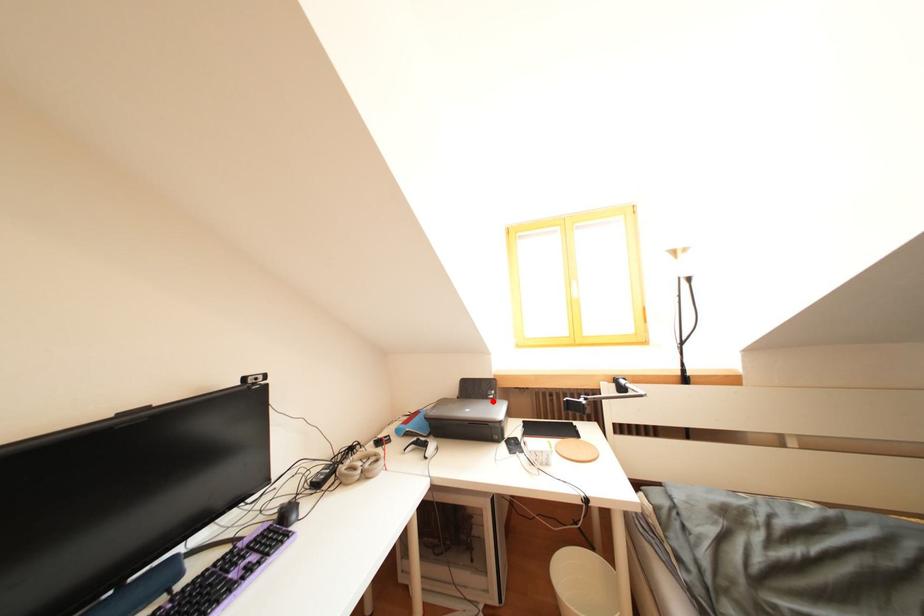
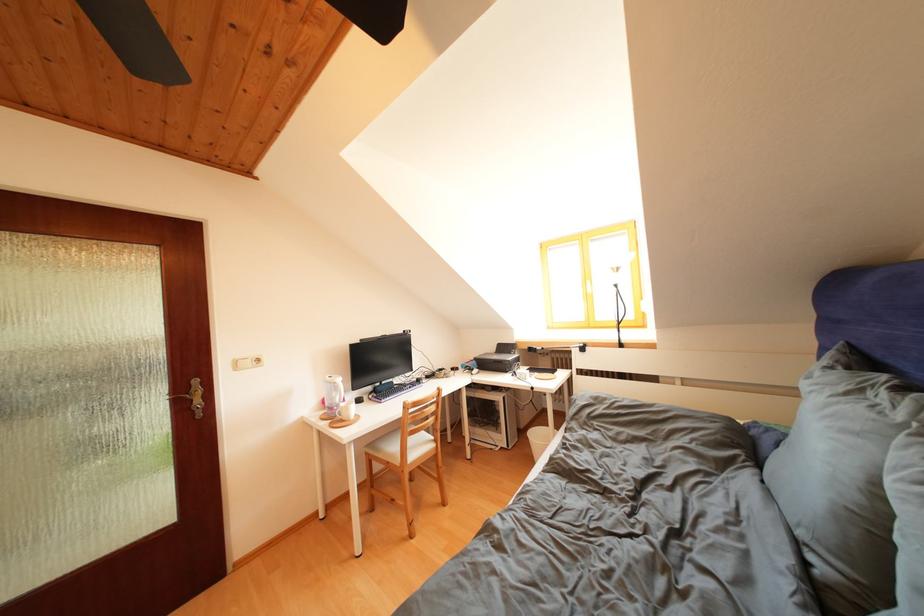
Find the pixel in the second image that matches the highlighted location in the first image.

(517, 358)